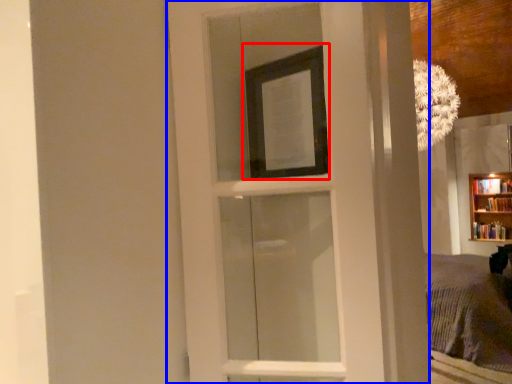
Question: Among these objects, which one is nearest to the camera, picture frame (highlighted by a red box) or door (highlighted by a blue box)?

Choices:
 (A) picture frame
 (B) door

Answer: (B)